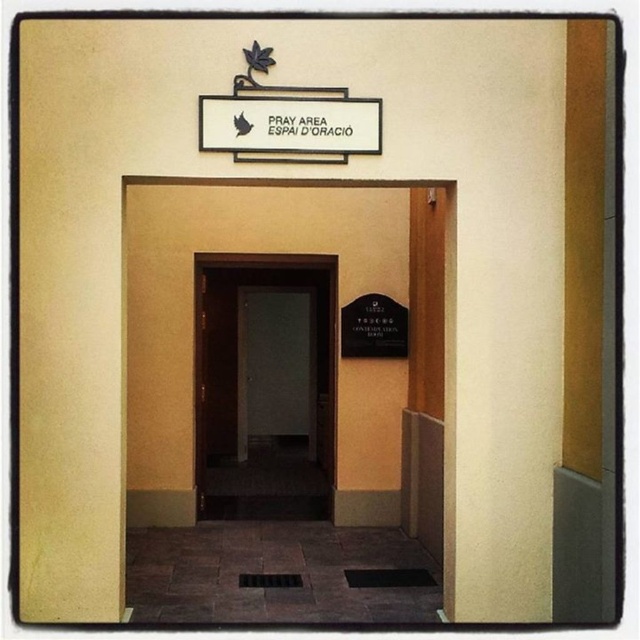
Consider the image. Can you confirm if dark wood door at center is positioned below white plastic sign at upper center?

Yes, dark wood door at center is below white plastic sign at upper center.

Does dark wood door at center have a larger size compared to white plastic sign at upper center?

Yes, dark wood door at center is bigger than white plastic sign at upper center.

Between point (301, 492) and point (268, 104), which one is positioned behind?

Positioned behind is point (301, 492).

This screenshot has height=640, width=640. What are the coordinates of `dark wood door at center` in the screenshot? It's located at (264, 387).

Does wooden door at center appear on the right side of white plastic sign at upper center?

No, wooden door at center is not to the right of white plastic sign at upper center.

Is wooden door at center thinner than white plastic sign at upper center?

In fact, wooden door at center might be wider than white plastic sign at upper center.

Where is `wooden door at center`? The height and width of the screenshot is (640, 640). wooden door at center is located at coordinates (336, 326).

Which is above, wooden door at center or dark wood door at center?

Positioned higher is wooden door at center.

Does wooden door at center have a lesser height compared to dark wood door at center?

In fact, wooden door at center may be taller than dark wood door at center.

Who is more forward, (348, 291) or (280, 384)?

Positioned in front is point (348, 291).

Find the location of a particular element. Image resolution: width=640 pixels, height=640 pixels. wooden door at center is located at coordinates (336, 326).